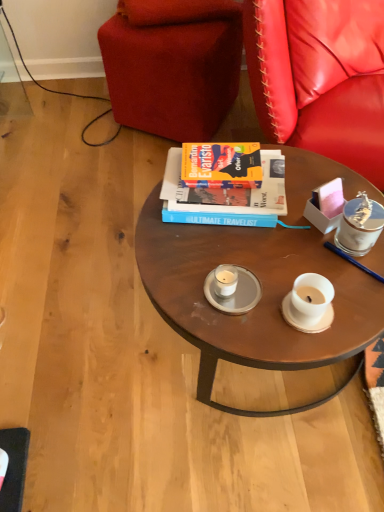
Question: Which direction should I rotate to face white matte candle at center, marked as the first coffee cup in a bottom-to-top arrangement, — up or down?

Choices:
 (A) down
 (B) up

Answer: (A)

Question: Can you confirm if wooden round table at center is shorter than hardcover book at center?

Choices:
 (A) yes
 (B) no

Answer: (B)

Question: Is wooden round table at center positioned far away from hardcover book at center?

Choices:
 (A) yes
 (B) no

Answer: (B)

Question: Is wooden round table at center next to hardcover book at center and touching it?

Choices:
 (A) yes
 (B) no

Answer: (B)

Question: Is wooden round table at center taller than hardcover book at center?

Choices:
 (A) yes
 (B) no

Answer: (A)

Question: Considering the relative positions of wooden round table at center and hardcover book at center in the image provided, is wooden round table at center to the left of hardcover book at center from the viewer's perspective?

Choices:
 (A) no
 (B) yes

Answer: (A)

Question: Considering the relative sizes of wooden round table at center and hardcover book at center in the image provided, is wooden round table at center smaller than hardcover book at center?

Choices:
 (A) yes
 (B) no

Answer: (B)

Question: Can you confirm if white matte candle at center, marked as the first coffee cup in a bottom-to-top arrangement, is positioned to the left of clear glass saucer at center?

Choices:
 (A) yes
 (B) no

Answer: (A)

Question: Does white matte candle at center, marked as the first coffee cup in a bottom-to-top arrangement, have a greater width compared to clear glass saucer at center?

Choices:
 (A) yes
 (B) no

Answer: (B)

Question: Is clear glass saucer at center located within white matte candle at center, acting as the second coffee cup starting from the right?

Choices:
 (A) yes
 (B) no

Answer: (B)

Question: From the image's perspective, would you say white matte candle at center, marked as the first coffee cup in a bottom-to-top arrangement, is shown under clear glass saucer at center?

Choices:
 (A) yes
 (B) no

Answer: (B)

Question: Does white matte candle at center, marked as the first coffee cup in a bottom-to-top arrangement, appear on the right side of clear glass saucer at center?

Choices:
 (A) yes
 (B) no

Answer: (B)

Question: Can you see white matte candle at center, marked as the 1th coffee cup in a left-to-right arrangement, touching clear glass saucer at center?

Choices:
 (A) no
 (B) yes

Answer: (B)

Question: Does velvet red studio couch at upper center have a lesser width compared to wooden round table at center?

Choices:
 (A) yes
 (B) no

Answer: (A)